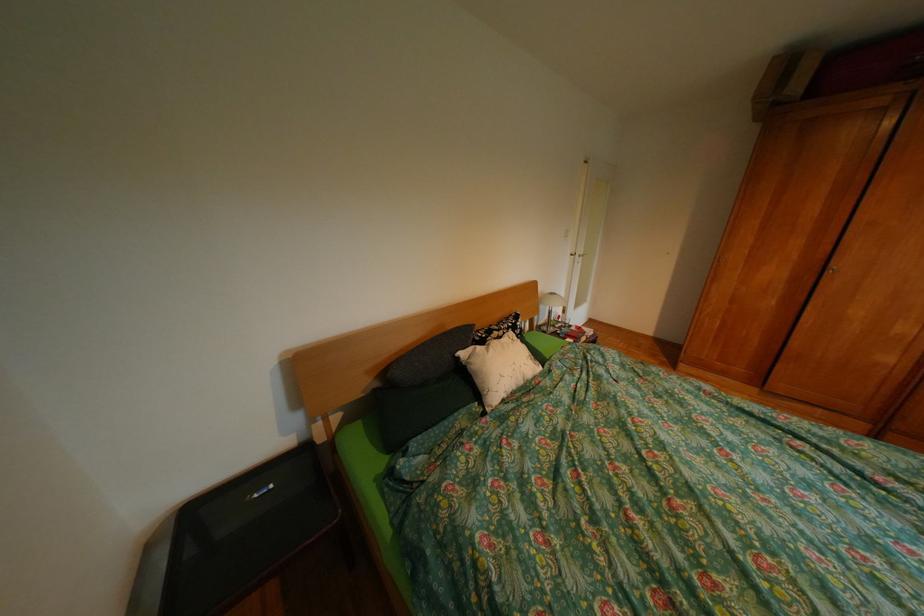
Which object does [428,359] point to?

This point indicates the textured black pillow.